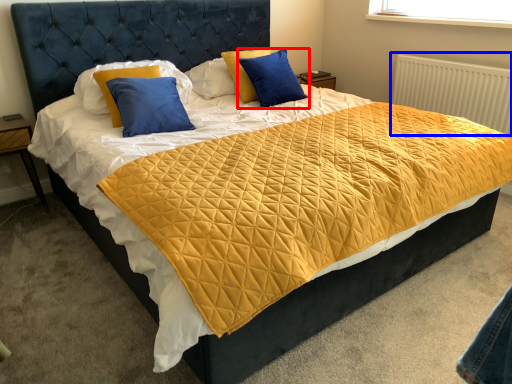
Question: Which point is closer to the camera, pillow (highlighted by a red box) or radiator (highlighted by a blue box)?

Choices:
 (A) pillow
 (B) radiator

Answer: (A)